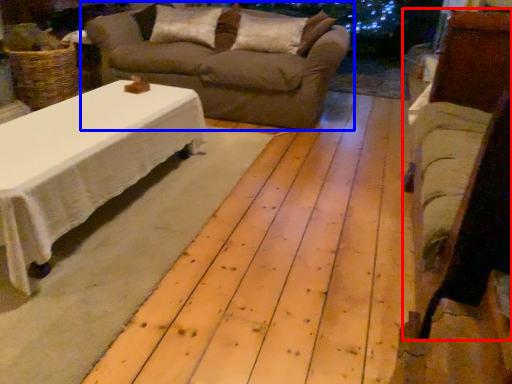
Question: Among these objects, which one is farthest to the camera, armchair (highlighted by a red box) or studio couch (highlighted by a blue box)?

Choices:
 (A) armchair
 (B) studio couch

Answer: (B)